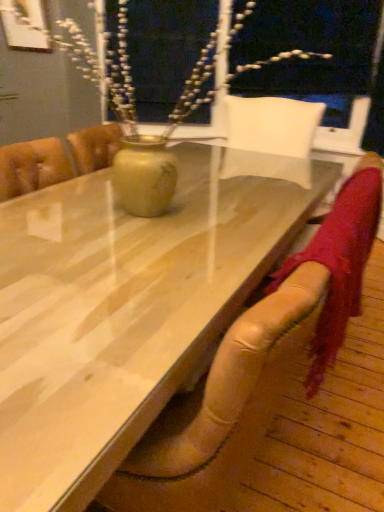
Question: From a real-world perspective, is leather armchair at lower right physically located above or below wooden table at center?

Choices:
 (A) above
 (B) below

Answer: (A)

Question: Visually, is leather armchair at lower right positioned to the left or to the right of wooden table at center?

Choices:
 (A) right
 (B) left

Answer: (A)

Question: In terms of width, does leather armchair at lower right look wider or thinner when compared to wooden table at center?

Choices:
 (A) thin
 (B) wide

Answer: (A)

Question: Looking at their shapes, would you say wooden table at center is wider or thinner than leather armchair at lower right?

Choices:
 (A) wide
 (B) thin

Answer: (A)

Question: Relative to leather armchair at lower right, is wooden table at center in front or behind?

Choices:
 (A) front
 (B) behind

Answer: (A)

Question: Visually, is wooden table at center positioned to the left or to the right of leather armchair at lower right?

Choices:
 (A) left
 (B) right

Answer: (A)

Question: From a real-world perspective, is wooden table at center above or below leather armchair at lower right?

Choices:
 (A) above
 (B) below

Answer: (B)